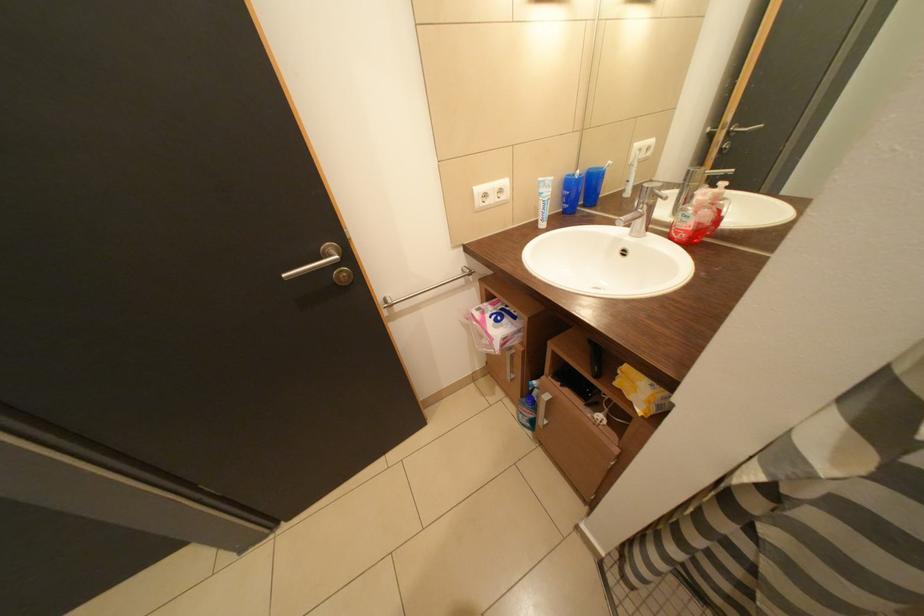
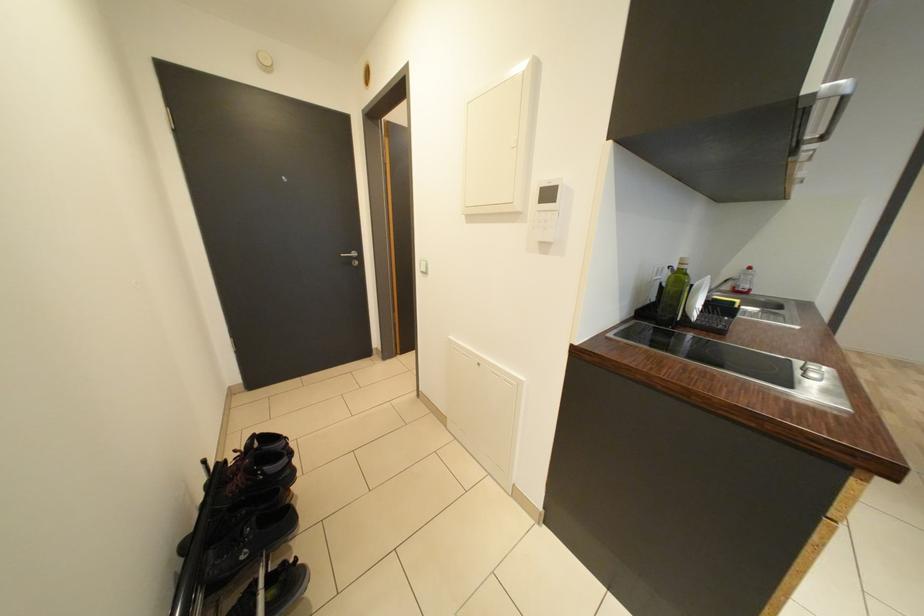
Which direction would the cameraman need to move to produce the second image?

The cameraman walked toward left, backward.